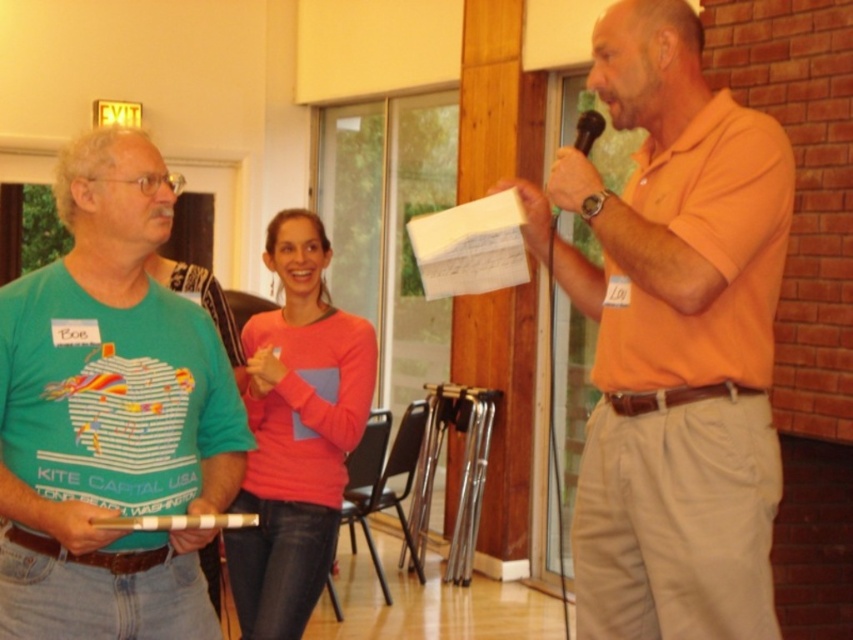
You are a sound technician adjusting the microphone stand. The pink matte sweater at center is currently 4.57 feet away from the black plastic microphone at upper right. If you move the microphone 2 feet closer to the sweater, will it be within the optimal 3 feet range for clear audio pickup?

After moving the black plastic microphone at upper right 2 feet closer to the pink matte sweater at center, the new distance becomes 2.57 feet, which is within the optimal 3 feet range for clear audio pickup.

You are organizing a small event and need to place a decorative stand that requires knowing the relative sizes of the orange cotton shirt at center and the black plastic microphone at upper right. Which object is bigger?

The orange cotton shirt at center is larger than the black plastic microphone at upper right according to the description.